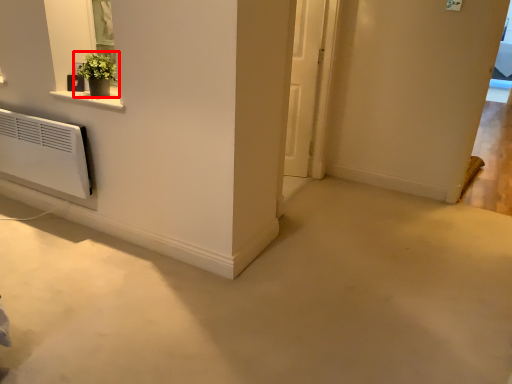
Question: Considering the relative positions of houseplant (annotated by the red box) and door in the image provided, where is houseplant (annotated by the red box) located with respect to the staircase?

Choices:
 (A) left
 (B) right

Answer: (A)